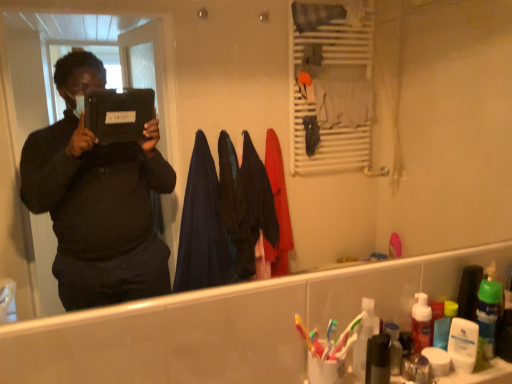
Question: Relative to metallic silver soap dispenser at lower right, positioned as the second toiletry in right-to-left order, is translucent plastic toothbrushes at lower right, which is the first toiletry from left to right, in front or behind?

Choices:
 (A) behind
 (B) front

Answer: (A)

Question: Is translucent plastic toothbrushes at lower right, arranged as the 3th toiletry when viewed from the right, bigger or smaller than metallic silver soap dispenser at lower right, which is counted as the 2th toiletry, starting from the left?

Choices:
 (A) small
 (B) big

Answer: (B)

Question: Which of these objects is positioned farthest from the multicolored plastic toothbrush at lower right?

Choices:
 (A) metallic silver soap dispenser at lower right, positioned as the second toiletry in right-to-left order
 (B) translucent plastic toothbrushes at lower right, which is the first toiletry from left to right
 (C) white matte lotion at lower right, arranged as the third toiletry when viewed from the left

Answer: (C)

Question: Which is nearer to the metallic silver soap dispenser at lower right, positioned as the second toiletry in right-to-left order?

Choices:
 (A) translucent plastic toothbrushes at lower right, arranged as the 3th toiletry when viewed from the right
 (B) white matte lotion at lower right, which is the first toiletry in right-to-left order
 (C) multicolored plastic toothbrush at lower right

Answer: (B)